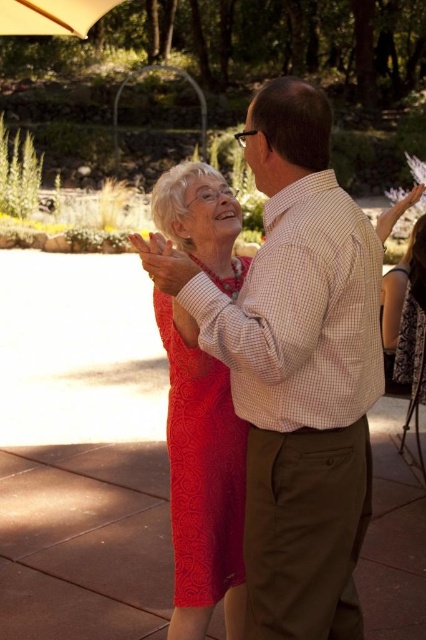
You are a photographer trying to capture the perfect shot of the matte lace dress at center. Based on its coordinates, where should you position your camera to ensure it is centered in the frame?

The matte lace dress at center is located at point (201, 468), so you should position your camera so that the dress is centered at those coordinates to capture it perfectly.

You are a photographer positioned at the center of the scene. You want to take a photo that includes both the checkered fabric shirt at center and the matte lace dress at center. Which one should you focus on first to ensure both are in sharp focus?

The checkered fabric shirt at center is closer to the viewer than the matte lace dress at center, so focusing on the checkered fabric shirt at center first will ensure both are in sharp focus.

You are a photographer trying to capture a closeup shot of both the checkered fabric shirt at center and the matte lace dress at center. Since you want to focus on the details of both, which one should you zoom in on first to ensure it fits within your camera frame?

The checkered fabric shirt at center is larger in size than the matte lace dress at center, so you should zoom in on the checkered fabric shirt at center first to ensure it fits within your camera frame before adjusting for the smaller matte lace dress at center.